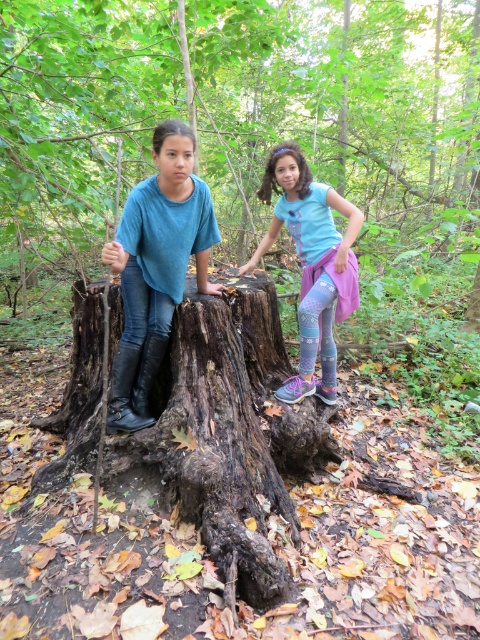
You are a photographer positioned behind the two people in the image. You want to take a photo that focuses on the dark brown rough tree trunk at center without the matte blue shirt at center blocking the view. Is the tree trunk already positioned in a way that it won

The dark brown rough tree trunk at center is closer to the viewer than the matte blue shirt at center, so the tree trunk will block the view of the shirt. Therefore, the photographer can focus on the tree trunk without the matte blue shirt at center obstructing the shot.